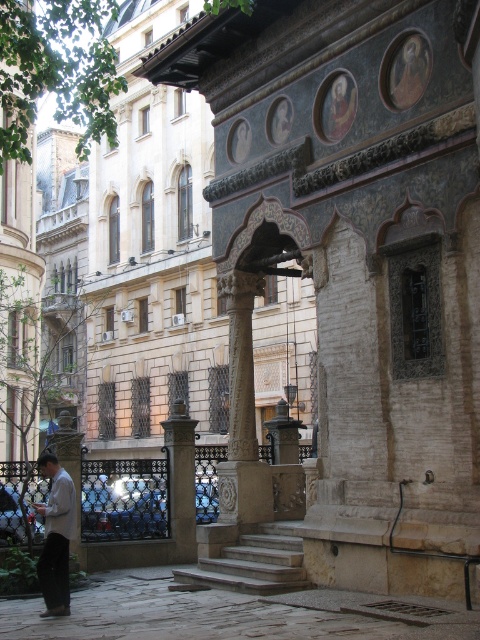
From the picture: You are a delivery person who needs to place a package on the polished stone column at center. However, there is a light brown leather jacket at lower left in the way. Can you move the jacket to access the column?

The light brown leather jacket at lower left is in front of the polished stone column at center, so you can move the jacket to access the column.

You are standing at the center of the image and want to take a photo of the white stone column at center. In which direction should you move to ensure the column is in the frame?

The white stone column at center is already at the center of the image, so you don not need to move. Just point the camera towards the center to capture it.